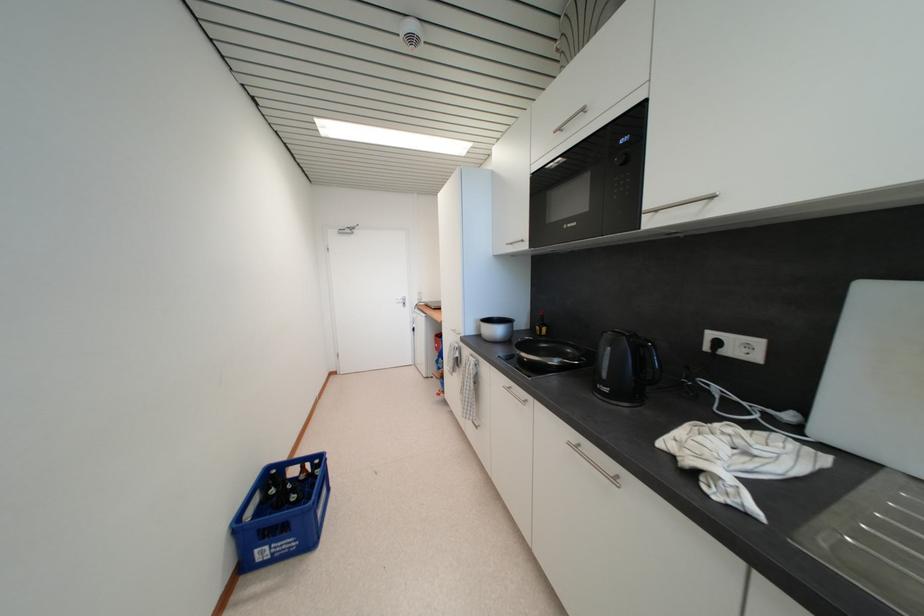
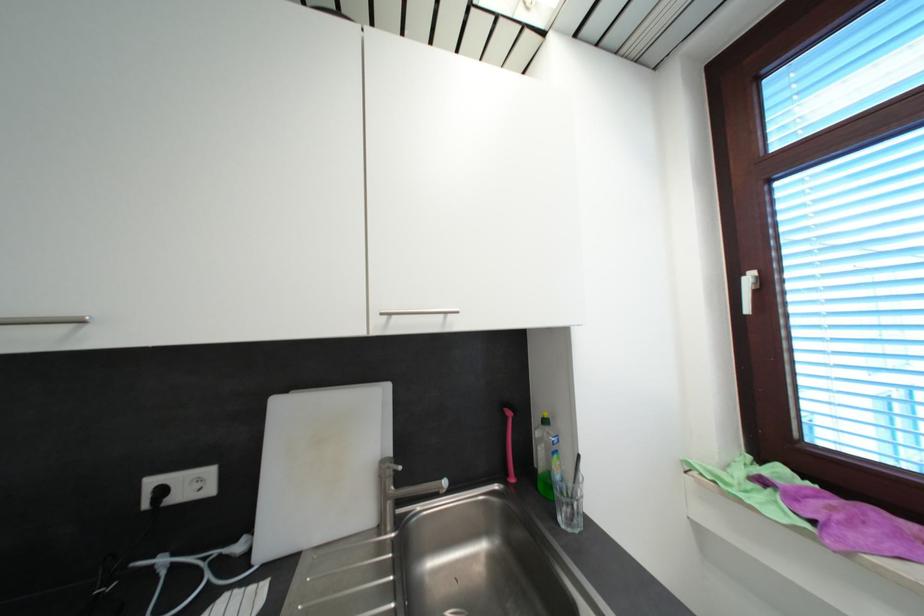
Question: The camera is either moving clockwise (left) or counter-clockwise (right) around the object. The first image is from the beginning of the video and the second image is from the end. Is the camera moving left or right when shooting the video?

Choices:
 (A) Left
 (B) Right

Answer: (A)